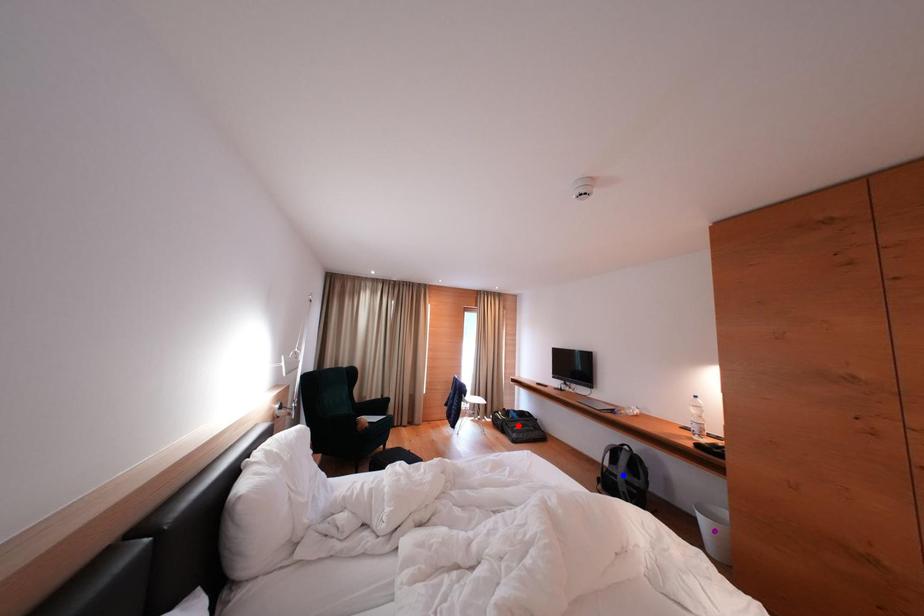
Order these from nearest to farthest:
A) purple point
B) blue point
C) red point

purple point → blue point → red point